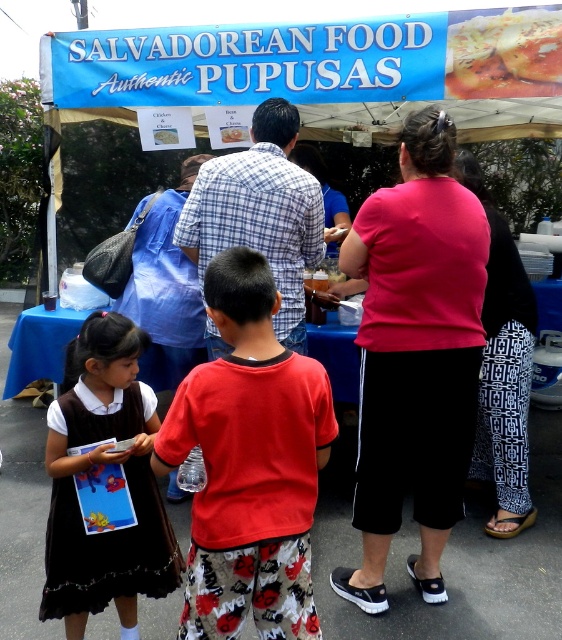
You are a customer at the food stall and want to order a pupusa. You notice two people near the table. One is wearing a matte black dress at lower left and the other is wearing a plaid shirt at center. Which person is closer to you?

The matte black dress at lower left is in front of the plaid shirt at center, so the person in the matte black dress at lower left is closer to you.